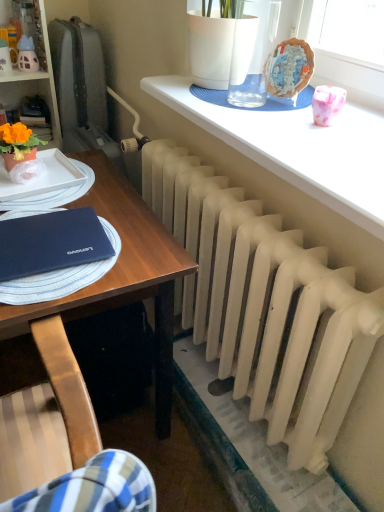
Question: Visually, is white matte radiator at upper center positioned to the left or to the right of orange matte flower pot at left?

Choices:
 (A) left
 (B) right

Answer: (B)

Question: Considering the positions of white matte radiator at upper center and orange matte flower pot at left in the image, is white matte radiator at upper center wider or thinner than orange matte flower pot at left?

Choices:
 (A) thin
 (B) wide

Answer: (B)

Question: Which is farther from the white matte radiator at lower center?

Choices:
 (A) white matte radiator at upper center
 (B) white matte desk at center
 (C) matte orange flower pot at left
 (D) matte black notebook at left
 (E) fluffy fabric flower at upper center

Answer: (C)

Question: Estimate the real-world distances between objects in this image. Which object is farther from the white matte radiator at upper center?

Choices:
 (A) orange matte flower pot at left
 (B) matte orange flower pot at left
 (C) white matte radiator at lower center
 (D) white matte desk at center
 (E) matte black notebook at left

Answer: (B)